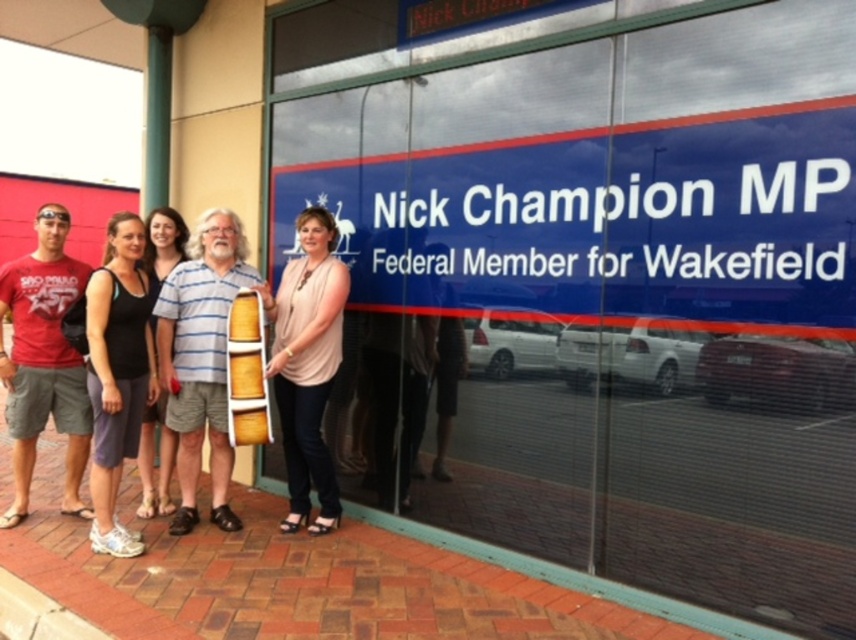
Can you confirm if wooden barrel at center is shorter than black fabric dress at center?

No, wooden barrel at center is not shorter than black fabric dress at center.

Does wooden barrel at center have a larger size compared to black fabric dress at center?

Yes.

You are a GUI agent. You are given a task and a screenshot of the screen. Output one action in this format:
    pyautogui.click(x=<x>, y=<y>)
    Task: Click on the wooden barrel at center
    This screenshot has height=640, width=856.
    Given the screenshot: What is the action you would take?
    pyautogui.click(x=201, y=358)

You are a GUI agent. You are given a task and a screenshot of the screen. Output one action in this format:
    pyautogui.click(x=<x>, y=<y>)
    Task: Click on the wooden barrel at center
    The width and height of the screenshot is (856, 640).
    Given the screenshot: What is the action you would take?
    pyautogui.click(x=201, y=358)

Is point (283, 320) closer to camera compared to point (171, 256)?

Yes, it is.

Between point (314, 390) and point (152, 221), which one is positioned behind?

The point (152, 221) is behind.

Measure the distance between pink fabric dress at center and camera.

4.01 meters

Find the location of a particular element. The height and width of the screenshot is (640, 856). pink fabric dress at center is located at coordinates (308, 365).

Can you confirm if wooden barrel at center is smaller than red cotton t-shirt at left?

Correct, wooden barrel at center occupies less space than red cotton t-shirt at left.

Is wooden barrel at center thinner than red cotton t-shirt at left?

Yes, wooden barrel at center is thinner than red cotton t-shirt at left.

Is point (182, 500) positioned before point (16, 280)?

No, it is not.

In order to click on wooden barrel at center in this screenshot , I will do `click(201, 358)`.